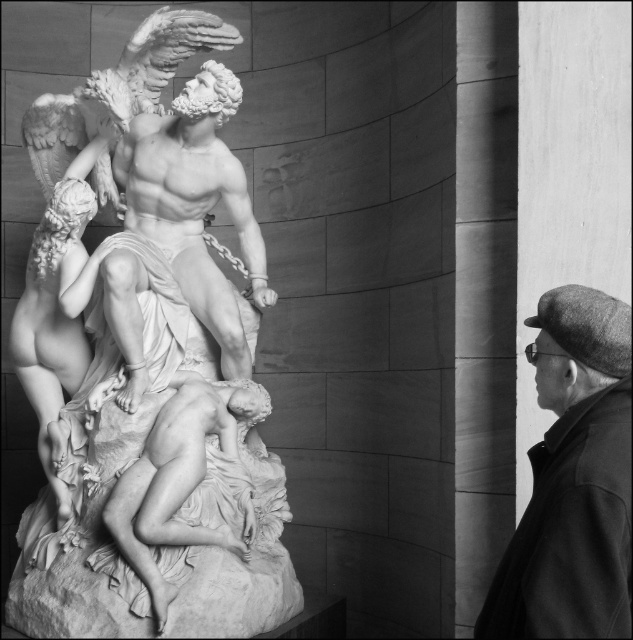
Consider the image. You are a photographer adjusting the focus of your camera. You want to ensure that both point at point (44, 433) and point at point (175, 429) are in focus. Since the camera can only focus on one plane, which point should you focus on to maximize the chances of both being sharp?

You should focus on point at point (175, 429) because it is closer to the camera than point at point (44, 433). By focusing on the closer point, the depth of field will extend backward, potentially keeping both points in focus.